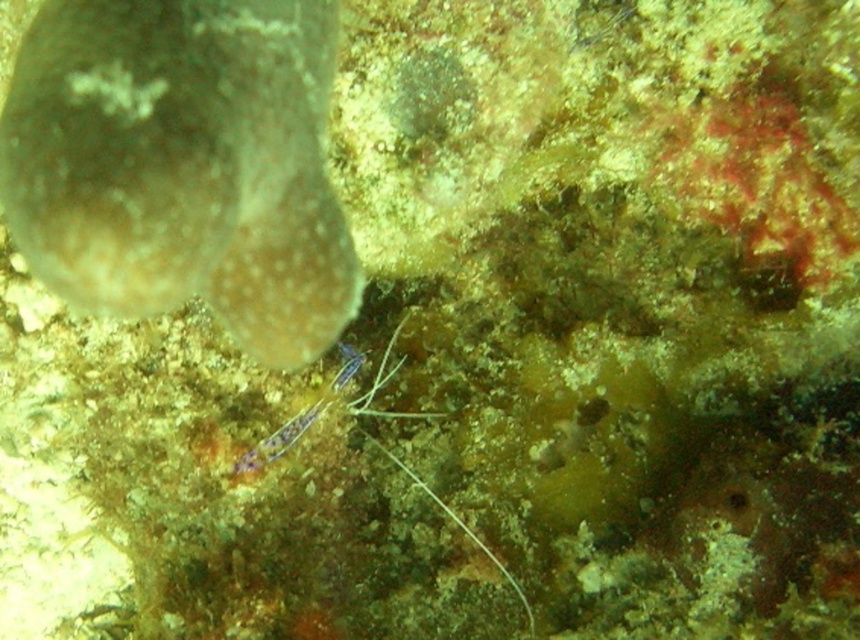
Question: In this image, where is brown speckled shell at upper left located relative to purple iridescent shrimp at center?

Choices:
 (A) below
 (B) above

Answer: (B)

Question: Where is brown speckled shell at upper left located in relation to purple iridescent shrimp at center in the image?

Choices:
 (A) above
 (B) below

Answer: (A)

Question: Which object is farther from the camera taking this photo?

Choices:
 (A) purple iridescent shrimp at center
 (B) brown speckled shell at upper left

Answer: (A)

Question: Which of the following is the closest to the observer?

Choices:
 (A) brown speckled shell at upper left
 (B) purple iridescent shrimp at center

Answer: (A)

Question: Is brown speckled shell at upper left below purple iridescent shrimp at center?

Choices:
 (A) yes
 (B) no

Answer: (B)